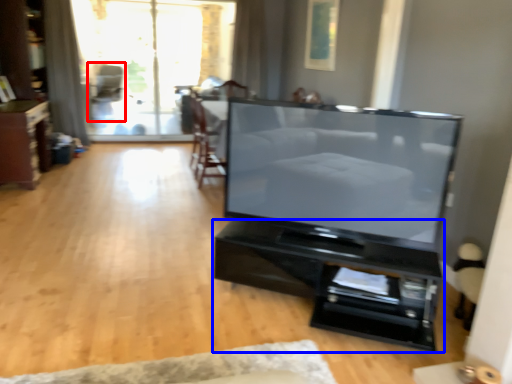
Question: Which of the following is the farthest to the observer, armchair (highlighted by a red box) or furniture (highlighted by a blue box)?

Choices:
 (A) armchair
 (B) furniture

Answer: (A)